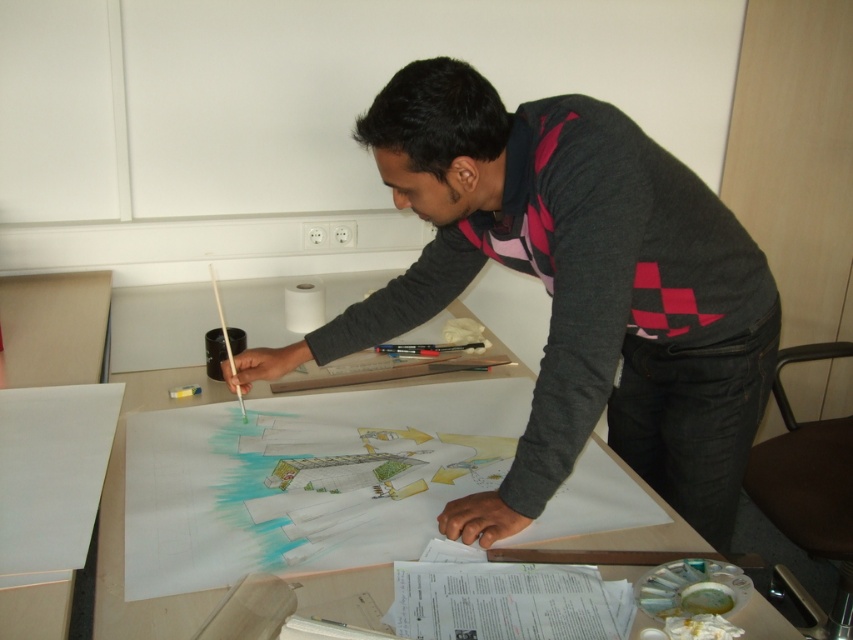
Question: Does white paper at center have a larger size compared to white matte paper at center?

Choices:
 (A) yes
 (B) no

Answer: (A)

Question: Which point appears farthest from the camera in this image?

Choices:
 (A) (270, 557)
 (B) (316, 308)

Answer: (B)

Question: Can you confirm if dark gray sweater at center is smaller than white paper at center?

Choices:
 (A) no
 (B) yes

Answer: (B)

Question: Is dark gray sweater at center below white paper at center?

Choices:
 (A) yes
 (B) no

Answer: (B)

Question: Based on their relative distances, which object is nearer to the dark gray sweater at center?

Choices:
 (A) white paper at center
 (B) white matte paper at center

Answer: (A)

Question: Which point is closer to the camera?

Choices:
 (A) dark gray sweater at center
 (B) colored pencil sketch at center
 (C) white paper at center
 (D) white matte paper at center

Answer: (C)